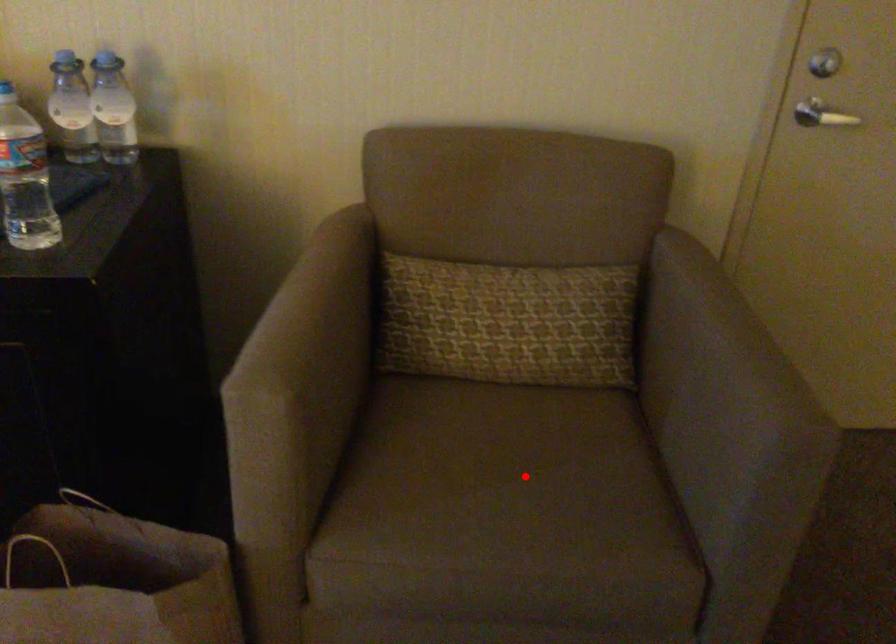
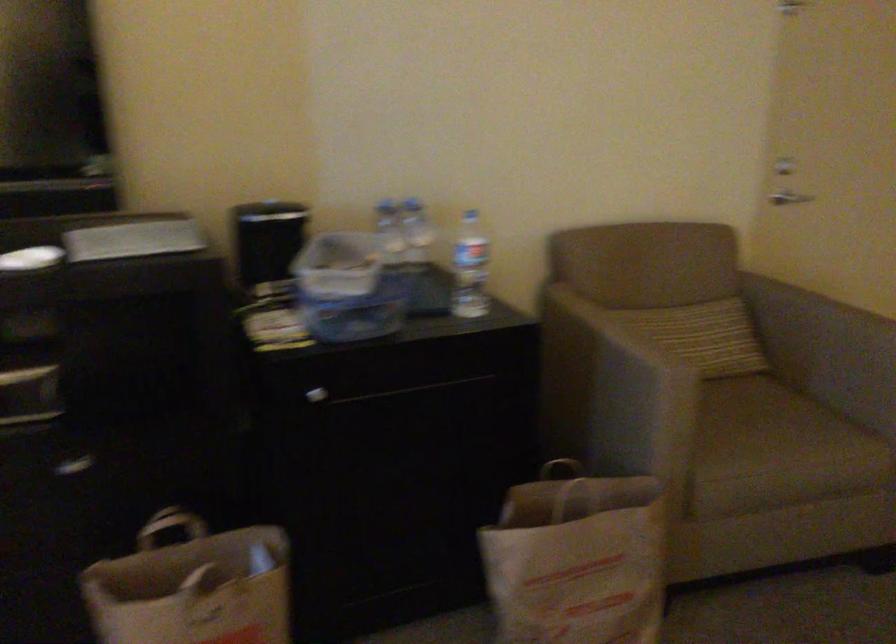
Locate, in the second image, the point that corresponds to the highlighted location in the first image.

(762, 418)